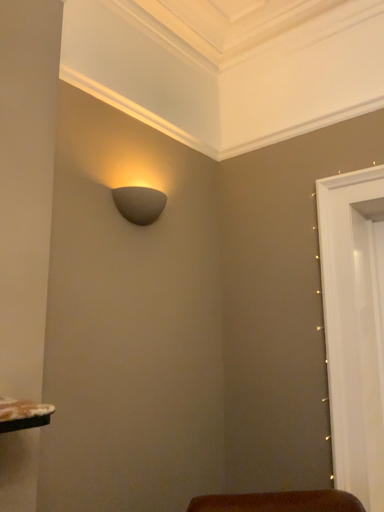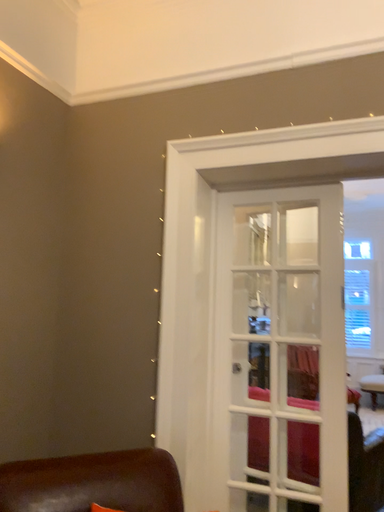
Question: Which way did the camera rotate in the video?

Choices:
 (A) rotated right
 (B) rotated left

Answer: (A)